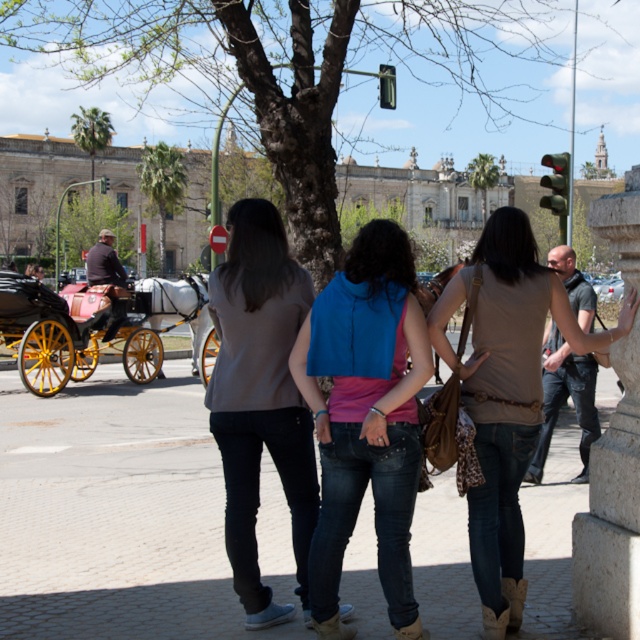
Question: From the image, what is the correct spatial relationship of cobblestone pavement at center in relation to matte gray shirt at center?

Choices:
 (A) left
 (B) right

Answer: (B)

Question: Is blue denim vest at center to the left of brown leather backpack at center from the viewer's perspective?

Choices:
 (A) no
 (B) yes

Answer: (B)

Question: Which point is closer to the camera?

Choices:
 (A) (x=579, y=449)
 (B) (x=268, y=416)

Answer: (B)

Question: Does blue denim vest at center appear on the right side of brown leather coach at left?

Choices:
 (A) no
 (B) yes

Answer: (B)

Question: Which point appears farthest from the camera in this image?

Choices:
 (A) (240, 428)
 (B) (88, 621)
 (C) (552, 392)
 (D) (99, 262)

Answer: (D)

Question: Estimate the real-world distances between objects in this image. Which object is closer to the matte gray shirt at center?

Choices:
 (A) blue denim vest at center
 (B) matte brown vest at center

Answer: (A)